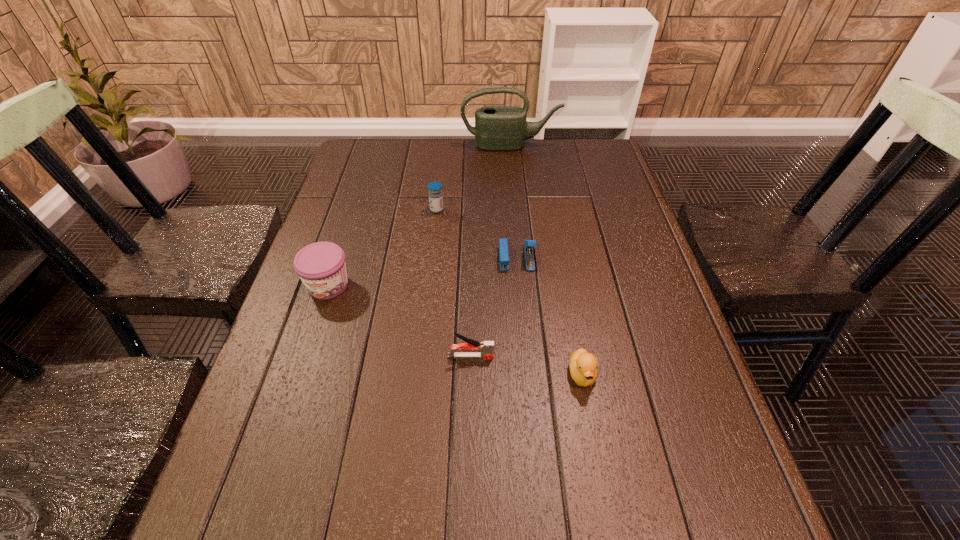
The height and width of the screenshot is (540, 960). I want to click on vacant region between the fifth nearest object and the jam, so coord(382,247).

Locate an element on the screen. vacant area that lies between the second object from left to right and the farthest object is located at coordinates (473, 178).

Identify which object is the closest to the duckling. Please provide its 2D coordinates. Your answer should be formatted as a tuple, i.e. [(x, y)], where the tuple contains the x and y coordinates of a point satisfying the conditions above.

[(486, 348)]

Find the location of `object that is the second nearest to the right stapler`. object that is the second nearest to the right stapler is located at coordinates (486, 348).

This screenshot has height=540, width=960. Identify the location of free location that satisfies the following two spatial constraints: 1. on the spout of the watering can; 2. on the handle side of the nearer stapler. (530, 356).

Where is `free space that satisfies the following two spatial constraints: 1. on the spout of the tallest object; 2. on the handle side of the nearer stapler`? free space that satisfies the following two spatial constraints: 1. on the spout of the tallest object; 2. on the handle side of the nearer stapler is located at coordinates (530, 356).